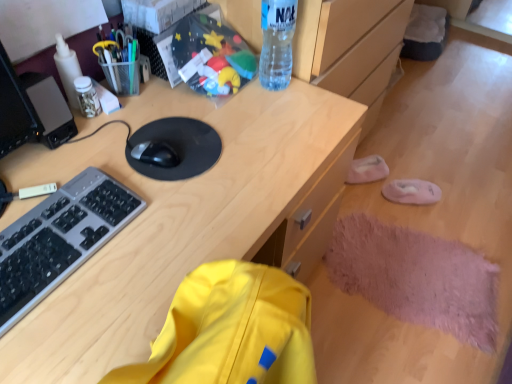
The width and height of the screenshot is (512, 384). Identify the location of empty space that is in between black matte mousepad at center and translucent plastic jar at upper left, which is counted as the 2th stationery, starting from the right. (118, 121).